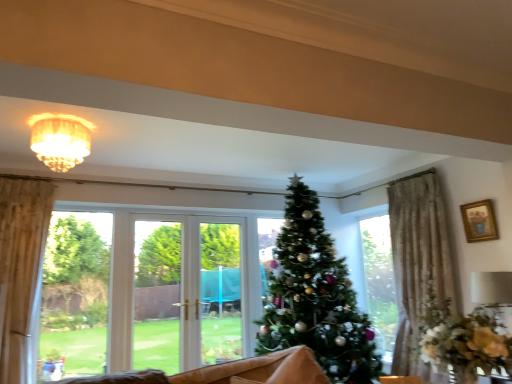
Question: From their relative heights in the image, would you say gold-framed picture at upper right is taller or shorter than green matte christmas tree at center?

Choices:
 (A) short
 (B) tall

Answer: (A)

Question: In the image, is gold-framed picture at upper right on the left side or the right side of green matte christmas tree at center?

Choices:
 (A) left
 (B) right

Answer: (B)

Question: Which is farther from the gold-framed picture at upper right?

Choices:
 (A) green matte christmas tree at center
 (B) wooden coffee table at lower center
 (C) matte gold chandelier at upper center

Answer: (C)

Question: Which is farther from the matte gold chandelier at upper center?

Choices:
 (A) wooden coffee table at lower center
 (B) green matte christmas tree at center
 (C) gold-framed picture at upper right

Answer: (C)